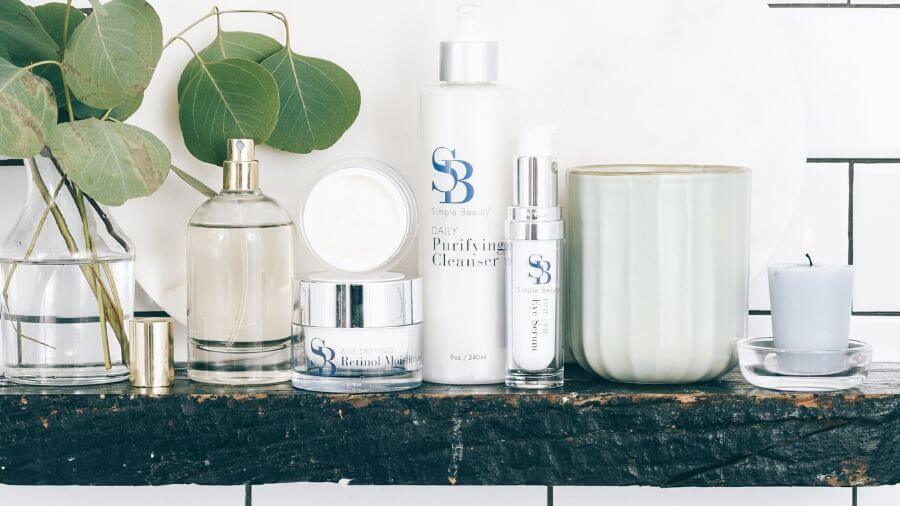
Where is `vase`? The image size is (900, 506). vase is located at coordinates (45, 332).